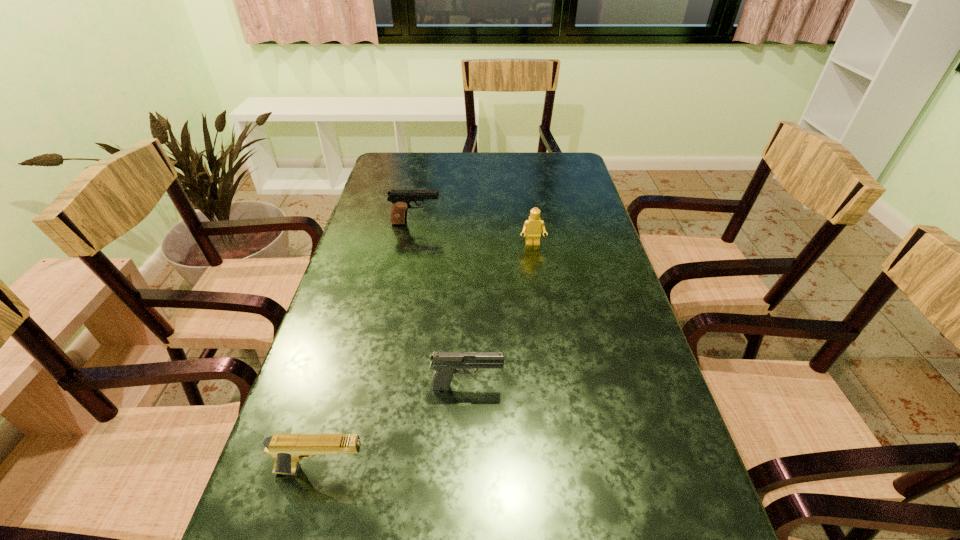
The width and height of the screenshot is (960, 540). In order to click on vacant area at the far edge in this screenshot , I will do tap(444, 183).

The width and height of the screenshot is (960, 540). In the image, there is a desktop. What are the coordinates of `vacant space at the left edge` in the screenshot? It's located at (413, 220).

In the image, there is a desktop. Identify the location of vacant space at the right edge. (564, 233).

Image resolution: width=960 pixels, height=540 pixels. I want to click on vacant space at the far left corner of the desktop, so click(x=403, y=168).

Locate an element on the screen. This screenshot has width=960, height=540. vacant space at the far right corner of the desktop is located at coordinates (557, 168).

What are the coordinates of `unoccupied area between the farthest object and the nearest pistol` in the screenshot? It's located at (369, 347).

I want to click on free point between the nearest object and the second farthest object, so click(x=427, y=357).

You are a GUI agent. You are given a task and a screenshot of the screen. Output one action in this format:
    pyautogui.click(x=<x>, y=<y>)
    Task: Click on the unoccupied position between the farthest pistol and the third nearest object
    The height and width of the screenshot is (540, 960).
    Given the screenshot: What is the action you would take?
    pyautogui.click(x=474, y=234)

Locate an element on the screen. vacant point located between the farthest pistol and the Lego is located at coordinates (474, 234).

This screenshot has width=960, height=540. In order to click on vacant area between the rightmost object and the nearest pistol in this screenshot , I will do `click(427, 357)`.